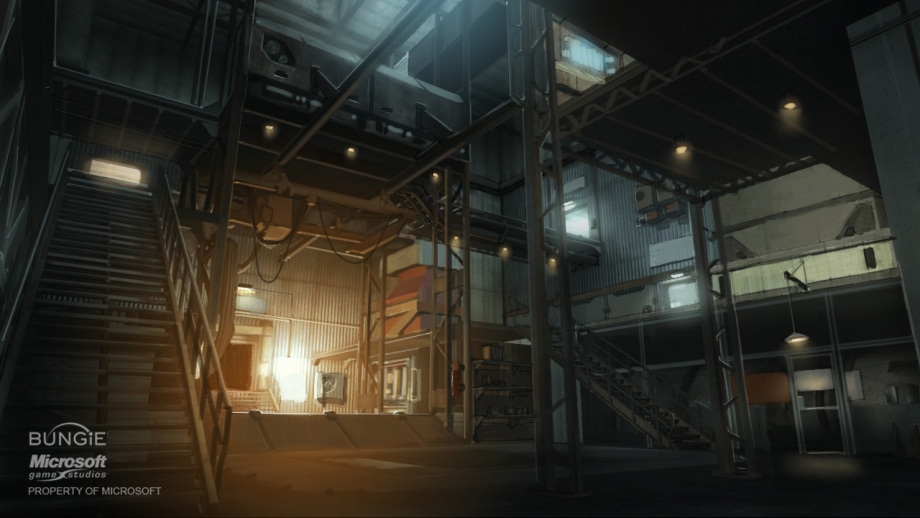
Identify the location of ceiling. This screenshot has height=518, width=920. (359, 19).